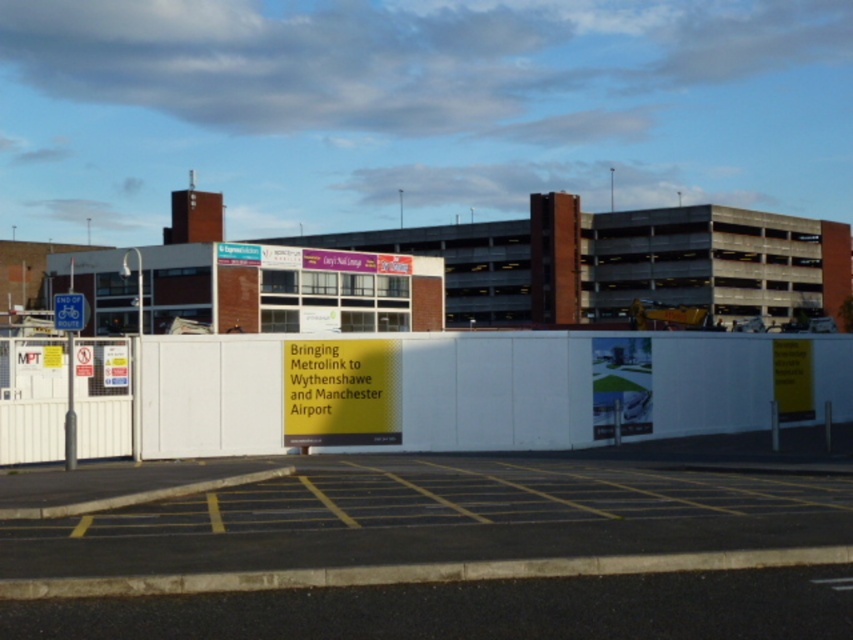
You are a delivery person trying to navigate through the construction site. You see a white matte barrier at center and a blue plastic bicycle sign at left. Which object is taller?

The white matte barrier at center is taller than the blue plastic bicycle sign at left.

You are a delivery driver who needs to park your vehicle in the parking lot behind the white temporary fence with a prominent yellow sign. The parking lot has spaces marked with yellow lines. Where should you park your vehicle relative to the white matte barrier at center?

The white matte barrier at center is located at point (x=573, y=388). Since the parking spaces are marked with yellow lines behind the fence, you should park your vehicle in one of the designated spaces marked by the yellow lines, which are likely positioned away from the barrier to ensure safety and compliance with parking regulations.

You are a delivery driver who needs to park your truck in the yellow asphalt parking lot at lower center. The truck is 2 meters tall. Can you safely park there without hitting the white matte barrier at center?

The yellow asphalt parking lot at lower center is not as tall as the white matte barrier at center, which means the barrier is taller. Since your truck is 2 meters tall, you need to ensure there is enough clearance. However, the height of the barrier isn not specified, so it is unclear if it poses a height restriction. You should check the barrier height before parking.